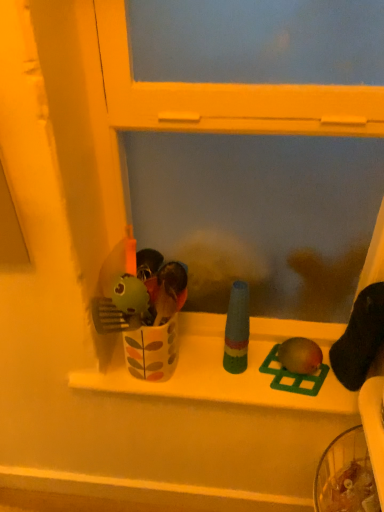
Question: In which direction should I rotate to look at green plastic bird at center, which is counted as the 2th toy, starting from the left?

Choices:
 (A) left
 (B) right

Answer: (B)

Question: Is green plastic bird at center, which is counted as the 2th toy, starting from the right, surrounding multicolored plastic bottle at center, the first toy from the left?

Choices:
 (A) yes
 (B) no

Answer: (B)

Question: Is green plastic bird at center, which is counted as the 2th toy, starting from the right, wider than multicolored plastic bottle at center, the 3th toy when ordered from right to left?

Choices:
 (A) yes
 (B) no

Answer: (A)

Question: Could you tell me if green plastic bird at center, which is counted as the 2th toy, starting from the left, is turned towards multicolored plastic bottle at center, the 3th toy when ordered from right to left?

Choices:
 (A) yes
 (B) no

Answer: (B)

Question: From a real-world perspective, is green plastic bird at center, which is counted as the 2th toy, starting from the left, on top of multicolored plastic bottle at center, the first toy from the left?

Choices:
 (A) no
 (B) yes

Answer: (A)

Question: Can you confirm if green plastic bird at center, which is counted as the 2th toy, starting from the left, is positioned to the left of multicolored plastic bottle at center, the 3th toy when ordered from right to left?

Choices:
 (A) yes
 (B) no

Answer: (B)

Question: Is green plastic bird at center, which is counted as the 2th toy, starting from the left, further to camera compared to multicolored plastic bottle at center, the 3th toy when ordered from right to left?

Choices:
 (A) no
 (B) yes

Answer: (B)

Question: Is matte green toy at center, which is counted as the first toy, starting from the right, shorter than green plastic bird at center, which is counted as the 2th toy, starting from the left?

Choices:
 (A) no
 (B) yes

Answer: (A)

Question: Can you confirm if matte green toy at center, which ranks as the 3th toy in left-to-right order, is bigger than green plastic bird at center, which is counted as the 2th toy, starting from the left?

Choices:
 (A) yes
 (B) no

Answer: (A)

Question: Is matte green toy at center, which ranks as the 3th toy in left-to-right order, next to green plastic bird at center, which is counted as the 2th toy, starting from the right?

Choices:
 (A) no
 (B) yes

Answer: (B)

Question: From a real-world perspective, is matte green toy at center, which ranks as the 3th toy in left-to-right order, on top of green plastic bird at center, which is counted as the 2th toy, starting from the right?

Choices:
 (A) no
 (B) yes

Answer: (B)

Question: Can you confirm if matte green toy at center, which ranks as the 3th toy in left-to-right order, is positioned to the right of green plastic bird at center, which is counted as the 2th toy, starting from the right?

Choices:
 (A) yes
 (B) no

Answer: (A)

Question: Is matte green toy at center, which is counted as the first toy, starting from the right, oriented towards green plastic bird at center, which is counted as the 2th toy, starting from the left?

Choices:
 (A) no
 (B) yes

Answer: (A)

Question: Is multicolored plastic bottle at center, the 3th toy when ordered from right to left, completely or partially outside of white glossy window sill at center?

Choices:
 (A) yes
 (B) no

Answer: (A)